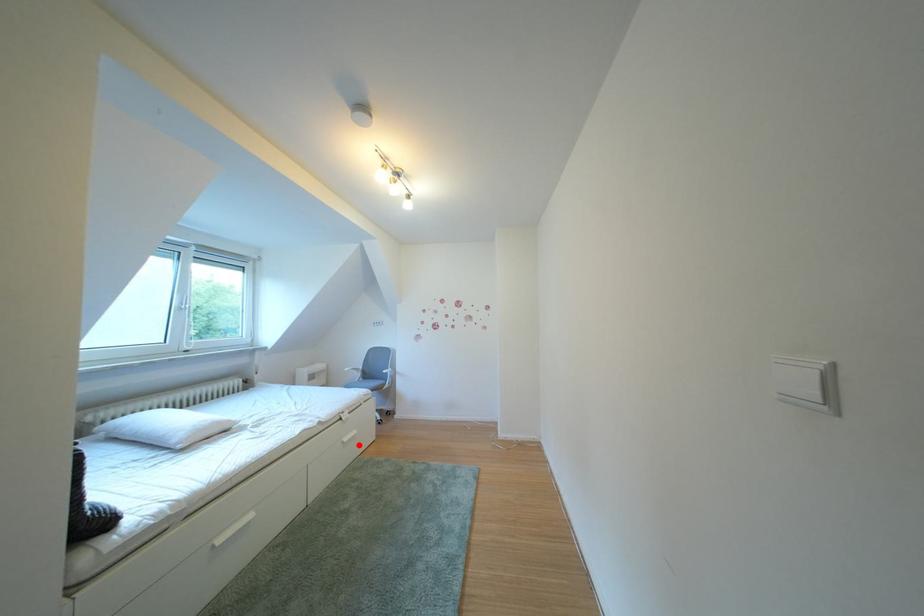
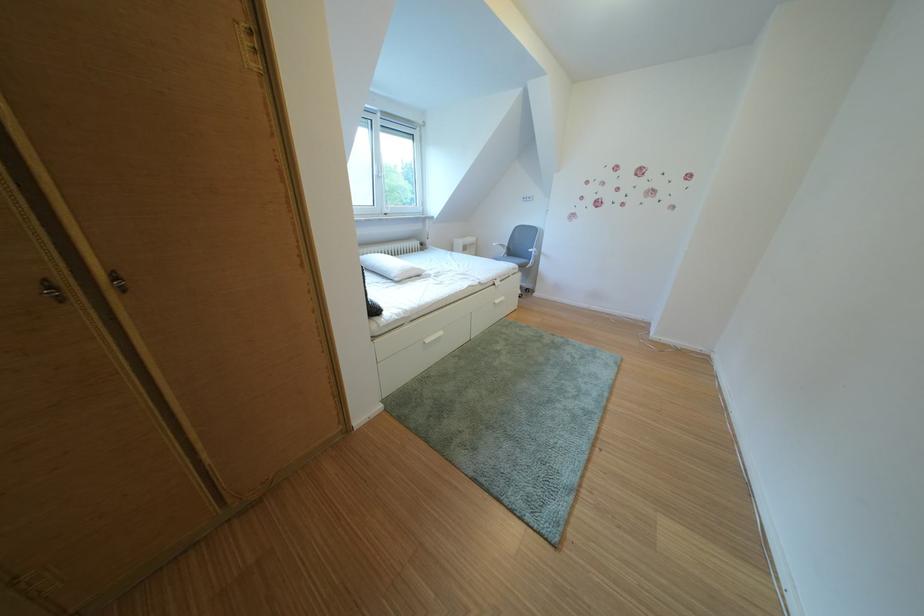
The point at the highlighted location is marked in the first image. Where is the corresponding point in the second image?

(511, 307)